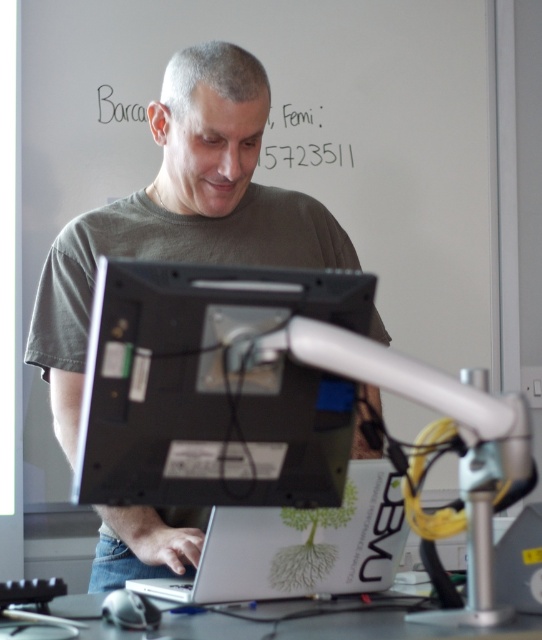
Does matte green t-shirt at center appear under white plastic table at lower center?

Actually, matte green t-shirt at center is above white plastic table at lower center.

Looking at this image, who is positioned more to the right, matte green t-shirt at center or white plastic table at lower center?

From the viewer's perspective, white plastic table at lower center appears more on the right side.

Find the location of a particular element. The height and width of the screenshot is (640, 542). matte green t-shirt at center is located at coordinates pos(180,212).

Is white plastic table at lower center above black paper at upper center?

Actually, white plastic table at lower center is below black paper at upper center.

Can you confirm if white plastic table at lower center is wider than black paper at upper center?

Correct, the width of white plastic table at lower center exceeds that of black paper at upper center.

Find the location of a particular element. The image size is (542, 640). white plastic table at lower center is located at coordinates (236, 618).

Identify the location of white plastic table at lower center. (236, 618).

Who is shorter, silver metallic laptop at center or white plastic table at lower center?

Standing shorter between the two is white plastic table at lower center.

Is point (363, 468) in front of point (16, 593)?

No, (363, 468) is behind (16, 593).

Is point (359, 499) less distant than point (392, 596)?

That is True.

This screenshot has width=542, height=640. I want to click on silver metallic laptop at center, so click(300, 547).